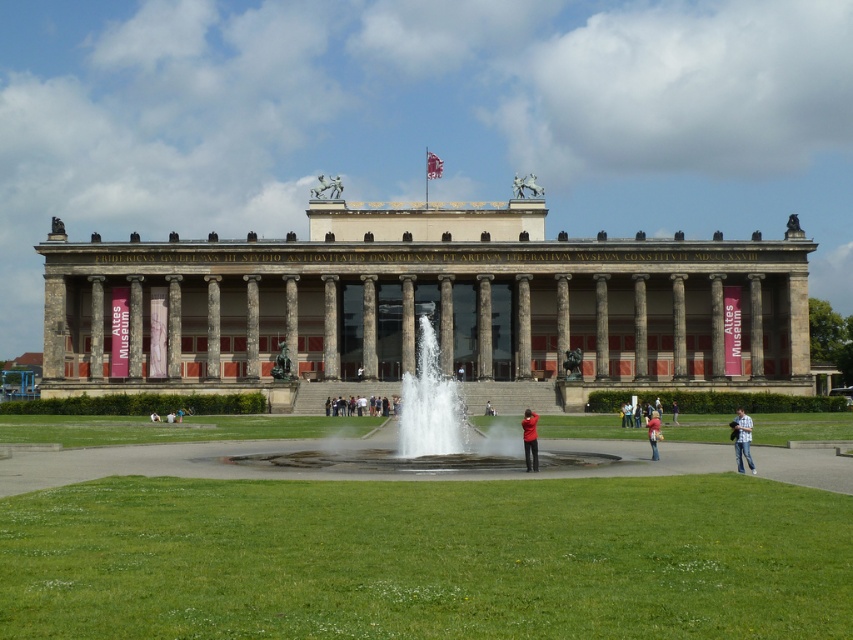
What do you see at coordinates (427, 304) in the screenshot? This screenshot has height=640, width=853. I see `stone classical building at center` at bounding box center [427, 304].

Does stone classical building at center appear on the right side of clear water fountain at center?

Correct, you'll find stone classical building at center to the right of clear water fountain at center.

Who is more distant from viewer, (564, 355) or (326, 461)?

The point (564, 355) is behind.

I want to click on stone classical building at center, so click(x=427, y=304).

Which is below, light blue jeans at center or red matte jacket at center?

Positioned lower is light blue jeans at center.

You are a GUI agent. You are given a task and a screenshot of the screen. Output one action in this format:
    pyautogui.click(x=<x>, y=<y>)
    Task: Click on the light blue jeans at center
    This screenshot has height=640, width=853.
    Given the screenshot: What is the action you would take?
    pyautogui.click(x=741, y=438)

Between point (128, 330) and point (527, 417), which one is positioned in front?

Point (527, 417) is in front.

Does stone classical building at center appear over red matte jacket at center?

Yes.

Locate an element on the screen. The width and height of the screenshot is (853, 640). stone classical building at center is located at coordinates (427, 304).